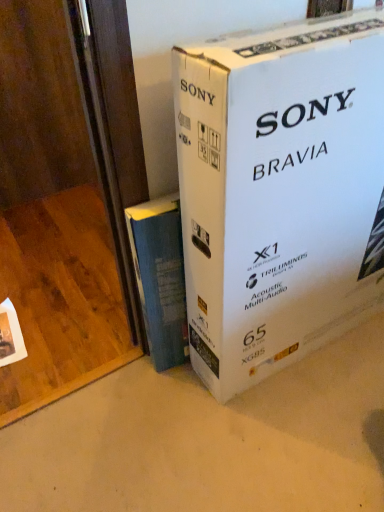
Locate an element on the screen. This screenshot has height=512, width=384. vacant area that is in front of white cardboard box at center is located at coordinates (314, 420).